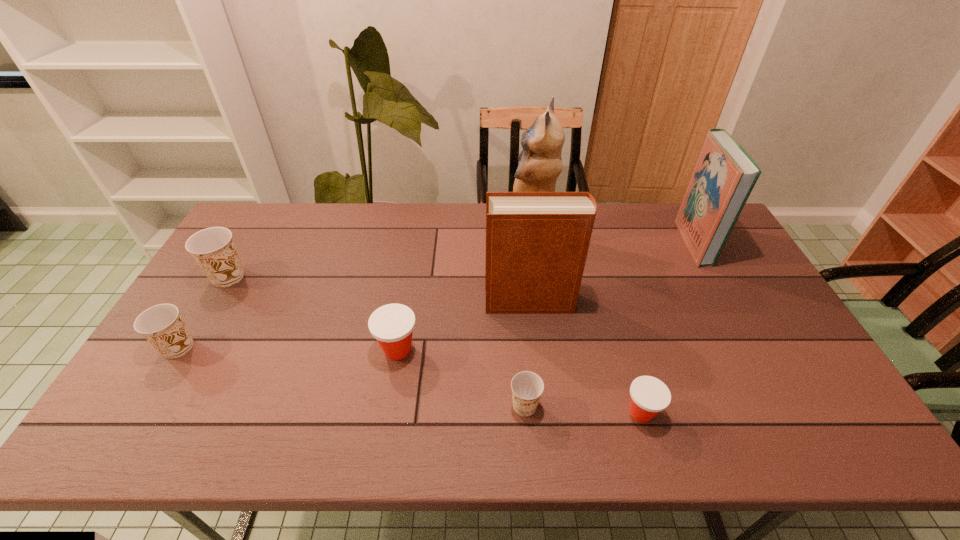
Find the location of `object that is at the far right corner`. object that is at the far right corner is located at coordinates (725, 174).

Locate an element on the screen. This screenshot has width=960, height=540. vacant space at the far edge is located at coordinates (383, 210).

You are a GUI agent. You are given a task and a screenshot of the screen. Output one action in this format:
    pyautogui.click(x=<x>, y=<y>)
    Task: Click on the blank space at the left edge of the desktop
    
    Given the screenshot: What is the action you would take?
    pyautogui.click(x=246, y=262)

The width and height of the screenshot is (960, 540). In the image, there is a desktop. In order to click on free space at the right edge in this screenshot , I will do `click(749, 306)`.

This screenshot has height=540, width=960. Identify the location of free area in between the farther hardback book and the cat. (611, 238).

The height and width of the screenshot is (540, 960). I want to click on unoccupied area between the rightmost orange Dixie cup and the cat, so click(x=527, y=320).

Find the location of a particular element. free space between the rightmost orange Dixie cup and the second farthest orange Dixie cup is located at coordinates (351, 376).

Locate an element on the screen. empty location between the left hardback book and the second object from right to left is located at coordinates (586, 357).

Locate an element on the screen. Image resolution: width=960 pixels, height=540 pixels. vacant area that lies between the second farthest orange Dixie cup and the right hardback book is located at coordinates (436, 295).

At what (x,y) coordinates should I click in order to perform the action: click on unoccupied position between the rightmost object and the farthest Dixie cup. Please return your answer as a coordinate pair (x, y). Image resolution: width=960 pixels, height=540 pixels. Looking at the image, I should click on (461, 260).